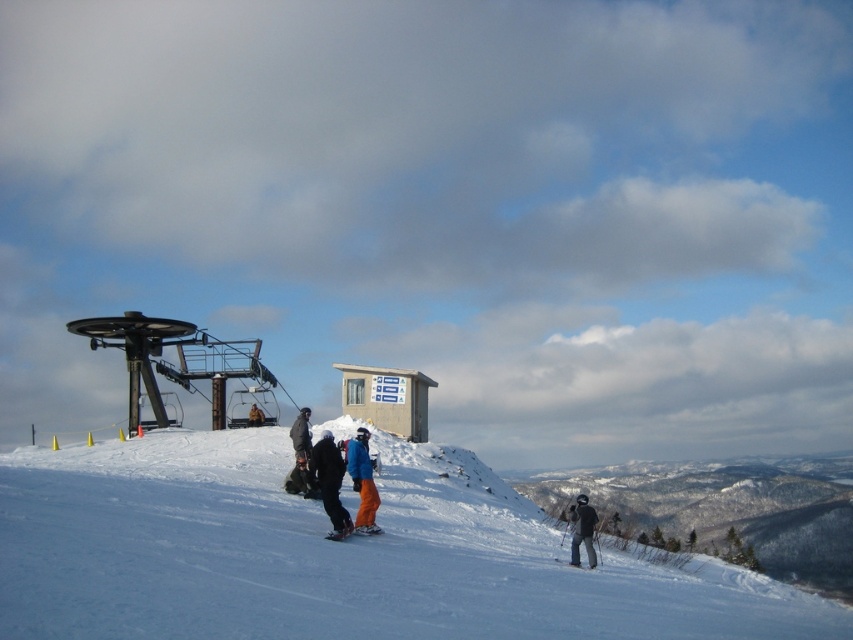
Does white powdery snow at center appear under matte orange ski at lower right?

Incorrect, white powdery snow at center is not positioned below matte orange ski at lower right.

Is point (317, 598) positioned after point (553, 557)?

That is False.

I want to click on white powdery snow at center, so click(334, 554).

Does blue snowboarder at center have a lesser height compared to black woolen hat at lower right?

Correct, blue snowboarder at center is not as tall as black woolen hat at lower right.

Can you confirm if blue snowboarder at center is wider than black woolen hat at lower right?

In fact, blue snowboarder at center might be narrower than black woolen hat at lower right.

Between point (363, 435) and point (587, 524), which one is positioned behind?

The point (363, 435) is behind.

At what (x,y) coordinates should I click in order to perform the action: click on blue snowboarder at center. Please return your answer as a coordinate pair (x, y). Image resolution: width=853 pixels, height=640 pixels. Looking at the image, I should click on (363, 481).

Describe the element at coordinates (171, 364) in the screenshot. I see `metallic gray ski lift at left` at that location.

Does metallic gray ski lift at left have a lesser width compared to matte orange ski at lower right?

No, metallic gray ski lift at left is not thinner than matte orange ski at lower right.

I want to click on metallic gray ski lift at left, so click(171, 364).